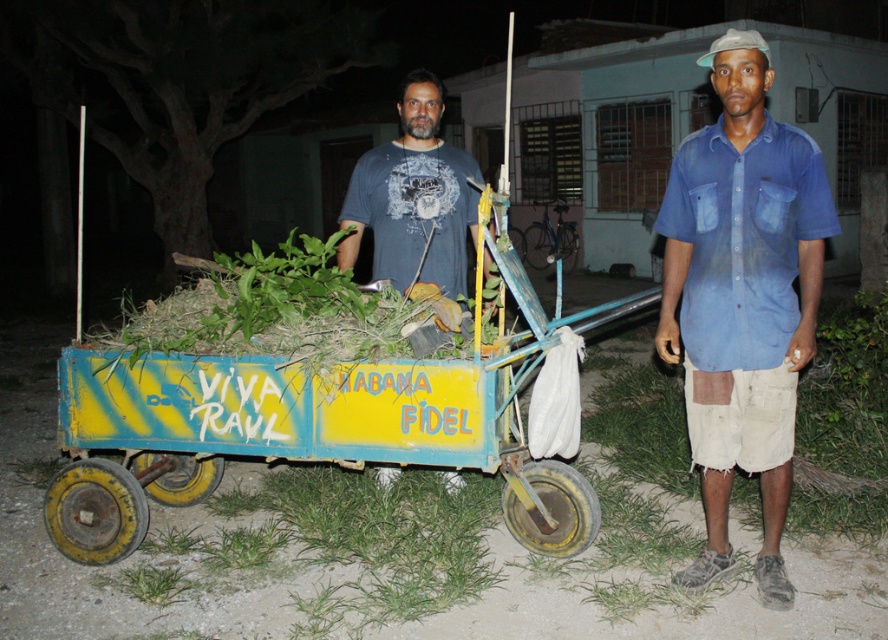
You are taking a photo of the cart and want to focus on both the point at coordinates point (x=408, y=444) and point (x=722, y=547). Which point is closer to your camera?

Point (x=408, y=444) is closer to the camera than point (x=722, y=547) because it is further to the camera than the other point.